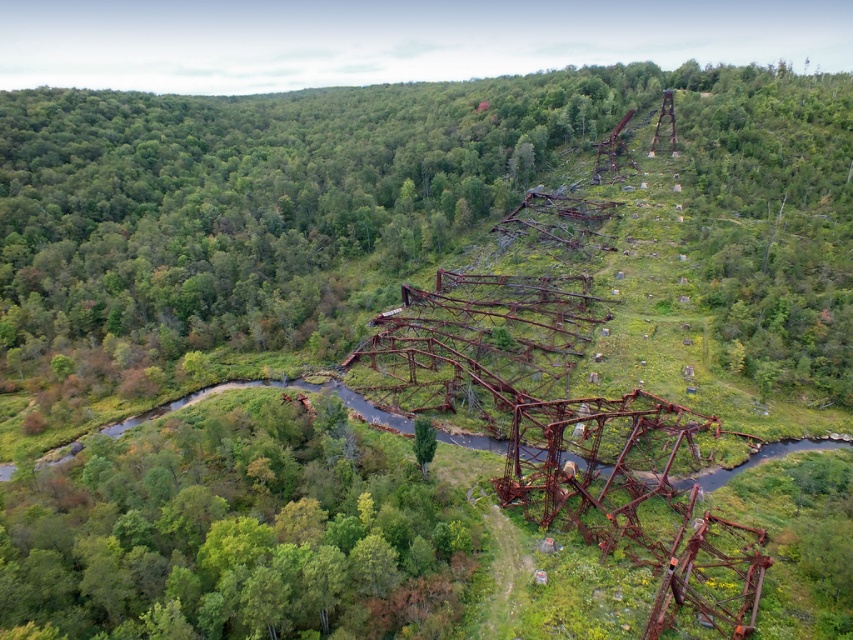
Can you confirm if green matte tree at lower left is positioned to the right of green matte tree at center?

Incorrect, green matte tree at lower left is not on the right side of green matte tree at center.

Between green matte tree at lower left and green matte tree at center, which one appears on the right side from the viewer's perspective?

Positioned to the right is green matte tree at center.

Is point (271, 532) positioned behind point (431, 428)?

No, (271, 532) is in front of (431, 428).

Find the location of `green matte tree at lower left`. green matte tree at lower left is located at coordinates (235, 532).